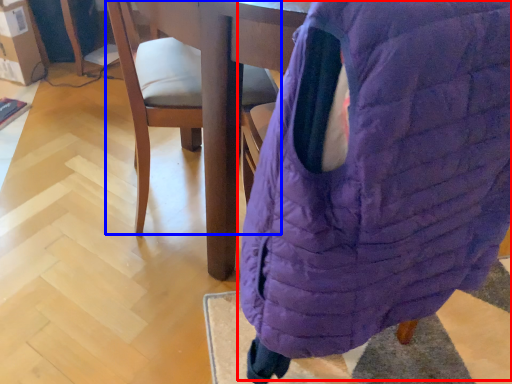
Question: Which object appears farthest to the camera in this image, bean bag chair (highlighted by a red box) or chair (highlighted by a blue box)?

Choices:
 (A) bean bag chair
 (B) chair

Answer: (B)